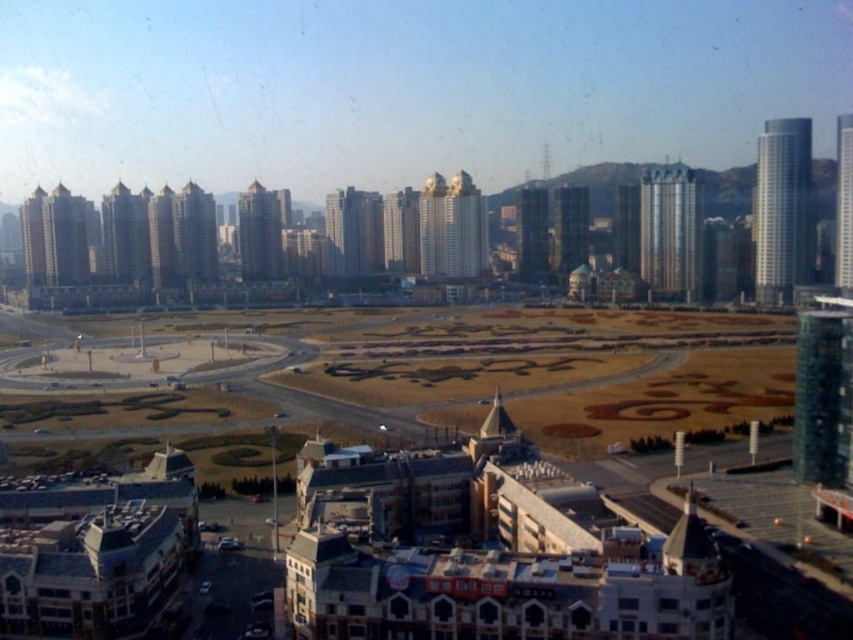
Question: Is silver metallic skyscraper at upper right positioned before glassy silver skyscraper at center?

Choices:
 (A) yes
 (B) no

Answer: (A)

Question: Which point is farther to the camera?

Choices:
 (A) matte glass skyscraper at center
 (B) gold reflective building at center
 (C) smooth gray building at center
 (D) smooth glass skyscraper at right

Answer: (C)

Question: Is gold reflective building at center closer to the viewer compared to matte gold skyscraper at center-left?

Choices:
 (A) yes
 (B) no

Answer: (A)

Question: Which object is farther from the camera taking this photo?

Choices:
 (A) smooth gray building at center
 (B) glassy silver skyscraper at center
 (C) green marble tower at right
 (D) matte gold skyscraper at center-left

Answer: (A)

Question: Estimate the real-world distances between objects in this image. Which object is closer to the matte gold building at left?

Choices:
 (A) gold reflective building at center
 (B) silver metallic skyscraper at upper right

Answer: (A)

Question: Can you confirm if silver metallic skyscraper at upper right is positioned above glassy silver skyscraper at center?

Choices:
 (A) yes
 (B) no

Answer: (B)